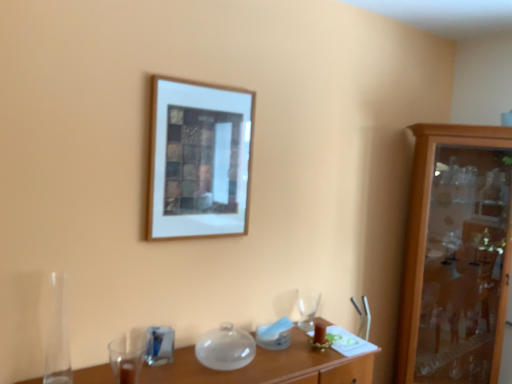
You are a GUI agent. You are given a task and a screenshot of the screen. Output one action in this format:
    pyautogui.click(x=<x>, y=<y>)
    Task: Click on the free space in front of blue glass at lower left, the first tableware positioned from the left
    
    Given the screenshot: What is the action you would take?
    pyautogui.click(x=153, y=373)